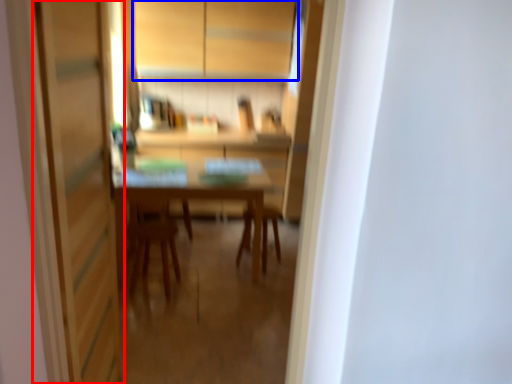
Question: Which point is further to the camera, screen door (highlighted by a red box) or cabinetry (highlighted by a blue box)?

Choices:
 (A) screen door
 (B) cabinetry

Answer: (B)